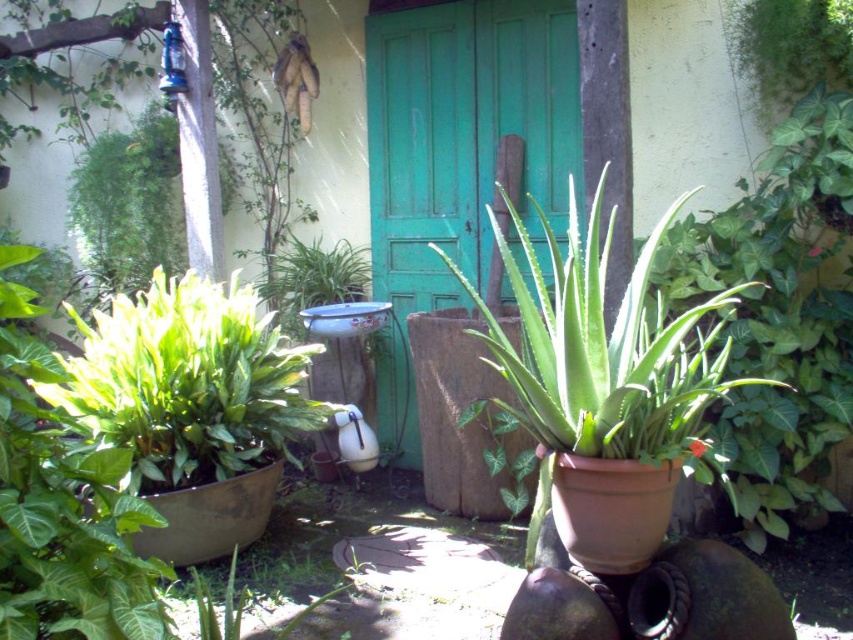
Is green wooden door at center in front of green matte plant at center?

No, it is behind green matte plant at center.

Who is shorter, green wooden door at center or green matte plant at center?

green matte plant at center

What do you see at coordinates (463, 134) in the screenshot?
I see `green wooden door at center` at bounding box center [463, 134].

Image resolution: width=853 pixels, height=640 pixels. Find the location of `green wooden door at center`. green wooden door at center is located at coordinates (463, 134).

Find the location of a particular element. The height and width of the screenshot is (640, 853). green matte plant at center is located at coordinates (604, 362).

Does green matte plant at center have a smaller size compared to green glossy leafy plant at left?

No, green matte plant at center is not smaller than green glossy leafy plant at left.

Does point (706, 348) come farther from viewer compared to point (44, 387)?

That is False.

Identify the location of green matte plant at center. (604, 362).

Between green wooden door at center and green glossy leafy plant at left, which one appears on the right side from the viewer's perspective?

From the viewer's perspective, green wooden door at center appears more on the right side.

Which is behind, point (560, 58) or point (256, 461)?

Point (560, 58)

Locate an element on the screen. green wooden door at center is located at coordinates (463, 134).